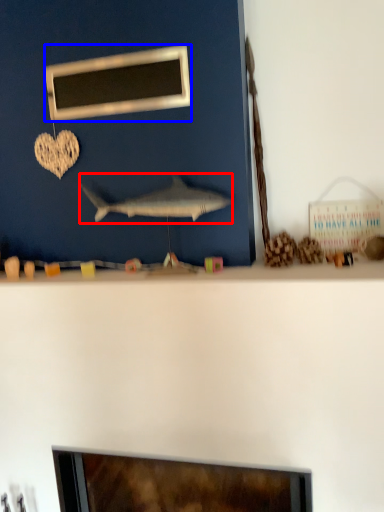
Question: Which of the following is the closest to the observer, fish (highlighted by a red box) or picture frame (highlighted by a blue box)?

Choices:
 (A) fish
 (B) picture frame

Answer: (A)